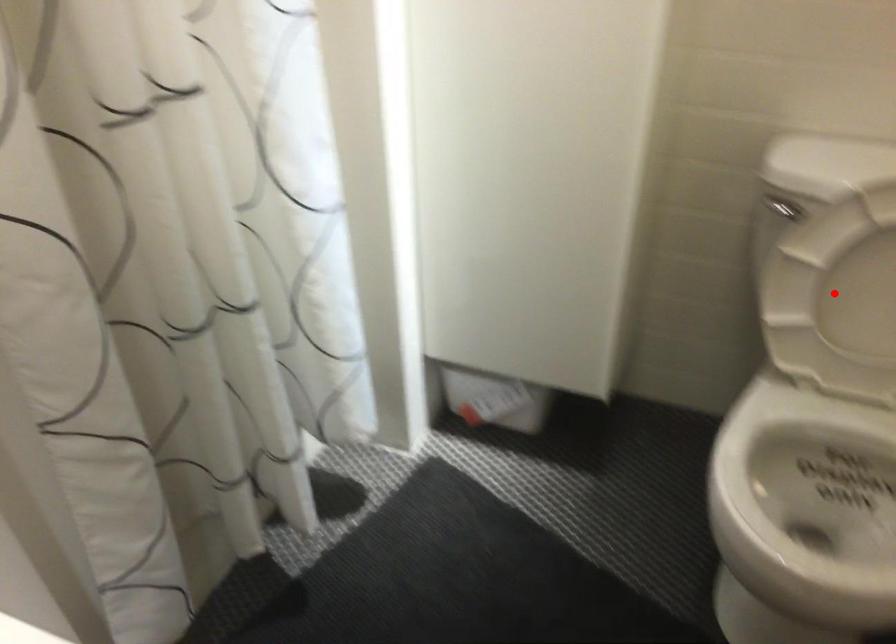
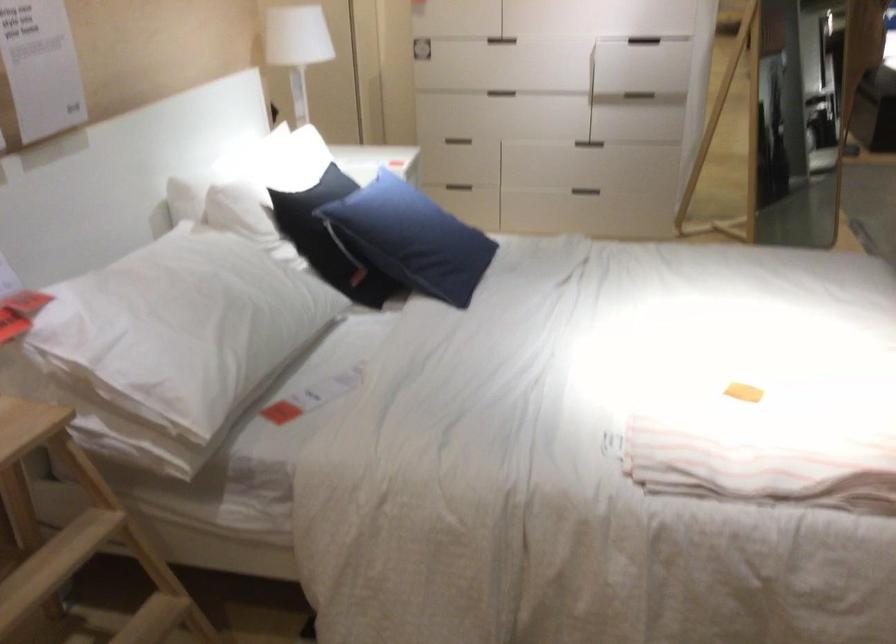
Question: I am providing you with two images of the same scene from different viewpoints. A red point is marked on the first image. At the location where the point appears in image 1, is it still visible in image 2?

Choices:
 (A) Yes
 (B) No

Answer: (B)